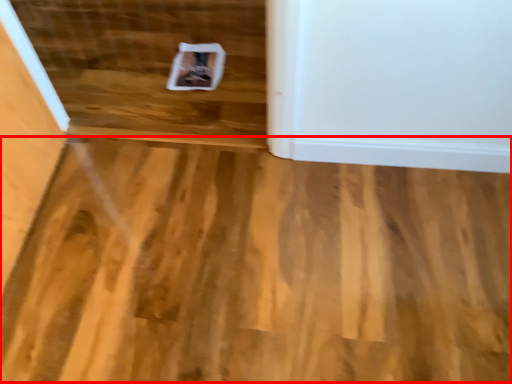
Question: From the image, what is the correct spatial relationship of plywood (annotated by the red box) in relation to stairwell?

Choices:
 (A) right
 (B) left

Answer: (A)